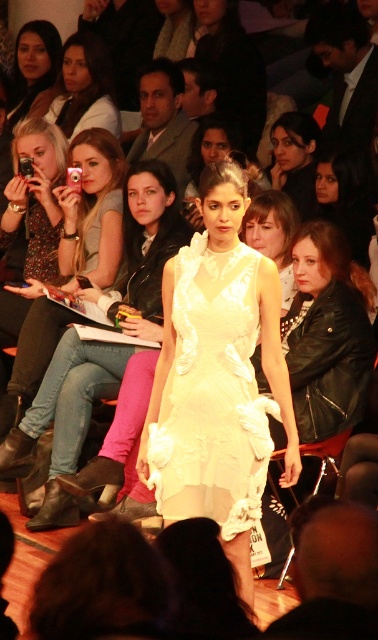
Can you confirm if white satin dress at center is taller than matte black leather jacket at upper center?

In fact, white satin dress at center may be shorter than matte black leather jacket at upper center.

Which is behind, point (255, 426) or point (260, 64)?

The point (260, 64) is behind.

This screenshot has width=378, height=640. What are the coordinates of `white satin dress at center` in the screenshot? It's located at (212, 394).

Is matte white dress at center below matte black leather jacket at upper right?

Indeed, matte white dress at center is positioned under matte black leather jacket at upper right.

Is matte white dress at center wider than matte black leather jacket at upper right?

Yes.

Between point (88, 401) and point (317, 202), which one is positioned behind?

The point (317, 202) is behind.

You are a GUI agent. You are given a task and a screenshot of the screen. Output one action in this format:
    pyautogui.click(x=<x>, y=<y>)
    Task: Click on the matte white dress at center
    The height and width of the screenshot is (640, 378).
    Given the screenshot: What is the action you would take?
    pyautogui.click(x=63, y=419)

Between denim jeans at center and matte black leather jacket at upper center, which one has less height?

Standing shorter between the two is denim jeans at center.

Can you confirm if denim jeans at center is thinner than matte black leather jacket at upper center?

Yes, denim jeans at center is thinner than matte black leather jacket at upper center.

The width and height of the screenshot is (378, 640). In order to click on denim jeans at center in this screenshot , I will do `click(92, 211)`.

The width and height of the screenshot is (378, 640). What are the coordinates of `denim jeans at center` in the screenshot? It's located at (92, 211).